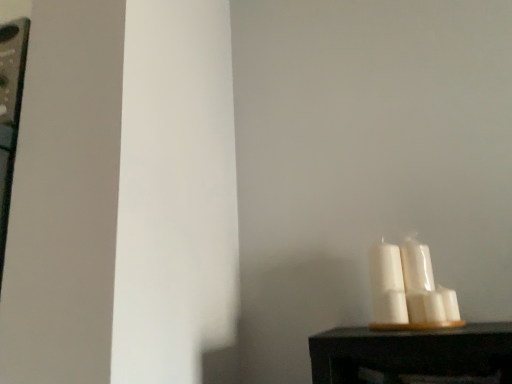
What are the coordinates of `white glossy candle at right, which is counted as the second candle, starting from the right` in the screenshot? It's located at (387, 285).

The width and height of the screenshot is (512, 384). Describe the element at coordinates (387, 285) in the screenshot. I see `white glossy candle at right, which is counted as the second candle, starting from the right` at that location.

Describe the element at coordinates (449, 303) in the screenshot. I see `white matte candle at lower right, which ranks as the first candle in right-to-left order` at that location.

How much space does white matte candle at lower right, which ranks as the first candle in right-to-left order, occupy vertically?

Answer: white matte candle at lower right, which ranks as the first candle in right-to-left order, is 7.56 centimeters in height.

In order to face white matte candle at lower right, which ranks as the first candle in right-to-left order, should I rotate leftwards or rightwards?

You should rotate right by 23.555 degrees.

At what (x,y) coordinates should I click in order to perform the action: click on white matte candle at lower right, which ranks as the first candle in right-to-left order. Please return your answer as a coordinate pair (x, y). The height and width of the screenshot is (384, 512). Looking at the image, I should click on (449, 303).

The image size is (512, 384). What are the coordinates of `white glossy candle at right, which is counted as the second candle, starting from the right` in the screenshot? It's located at (387, 285).

Considering the positions of objects white matte candle at lower right, which ranks as the first candle in right-to-left order, and white glossy candle at right, which is counted as the second candle, starting from the right, in the image provided, who is more to the left, white matte candle at lower right, which ranks as the first candle in right-to-left order, or white glossy candle at right, which is counted as the second candle, starting from the right,?

→ From the viewer's perspective, white glossy candle at right, which is counted as the second candle, starting from the right, appears more on the left side.

Consider the image. Is white matte candle at lower right, the second candle viewed from the left, in front of or behind white glossy candle at right, which is counted as the second candle, starting from the right, in the image?

Clearly, white matte candle at lower right, the second candle viewed from the left, is in front of white glossy candle at right, which is counted as the second candle, starting from the right.

Which is in front, point (455, 296) or point (385, 294)?

Point (385, 294)

From the image's perspective, is white matte candle at lower right, the second candle viewed from the left, located above white glossy candle at right, which is counted as the second candle, starting from the right?

Incorrect, from the image's perspective, white matte candle at lower right, the second candle viewed from the left, is lower than white glossy candle at right, which is counted as the second candle, starting from the right.

From a real-world perspective, is white matte candle at lower right, which ranks as the first candle in right-to-left order, positioned above or below white glossy candle at right, which ranks as the first candle in left-to-right order?

white matte candle at lower right, which ranks as the first candle in right-to-left order, is situated lower than white glossy candle at right, which ranks as the first candle in left-to-right order, in the real world.

Is white matte candle at lower right, which ranks as the first candle in right-to-left order, thinner than white glossy candle at right, which ranks as the first candle in left-to-right order?

Yes, white matte candle at lower right, which ranks as the first candle in right-to-left order, is thinner than white glossy candle at right, which ranks as the first candle in left-to-right order.

Considering the sizes of objects white matte candle at lower right, which ranks as the first candle in right-to-left order, and white glossy candle at right, which is counted as the second candle, starting from the right, in the image provided, who is shorter, white matte candle at lower right, which ranks as the first candle in right-to-left order, or white glossy candle at right, which is counted as the second candle, starting from the right,?

Standing shorter between the two is white matte candle at lower right, which ranks as the first candle in right-to-left order.

Can you confirm if white matte candle at lower right, the second candle viewed from the left, is bigger than white glossy candle at right, which is counted as the second candle, starting from the right?

Incorrect, white matte candle at lower right, the second candle viewed from the left, is not larger than white glossy candle at right, which is counted as the second candle, starting from the right.

Is white matte candle at lower right, which ranks as the first candle in right-to-left order, completely or partially outside of white glossy candle at right, which ranks as the first candle in left-to-right order?

Yes.

Is white matte candle at lower right, the second candle viewed from the left, touching white glossy candle at right, which is counted as the second candle, starting from the right?

No.

Could you tell me if white matte candle at lower right, the second candle viewed from the left, is facing white glossy candle at right, which is counted as the second candle, starting from the right?

No, white matte candle at lower right, the second candle viewed from the left, is not facing towards white glossy candle at right, which is counted as the second candle, starting from the right.

Measure the distance between white matte candle at lower right, the second candle viewed from the left, and white glossy candle at right, which is counted as the second candle, starting from the right.

They are 4.65 inches apart.

Locate an element on the screen. This screenshot has height=384, width=512. candle below the white glossy candle at right, which is counted as the second candle, starting from the right (from the image's perspective) is located at coordinates coord(449,303).

Between white glossy candle at right, which ranks as the first candle in left-to-right order, and white matte candle at lower right, which ranks as the first candle in right-to-left order, which one appears on the left side from the viewer's perspective?

white glossy candle at right, which ranks as the first candle in left-to-right order.

From the picture: Is white glossy candle at right, which is counted as the second candle, starting from the right, positioned behind white matte candle at lower right, the second candle viewed from the left?

Yes, it is.

Which point is more forward, (389, 279) or (445, 288)?

The point (445, 288) is in front.

From the image's perspective, who appears lower, white glossy candle at right, which is counted as the second candle, starting from the right, or white matte candle at lower right, which ranks as the first candle in right-to-left order?

From the image's view, white matte candle at lower right, which ranks as the first candle in right-to-left order, is below.

From a real-world perspective, is white glossy candle at right, which ranks as the first candle in left-to-right order, positioned above or below white matte candle at lower right, the second candle viewed from the left?

From a real-world perspective, white glossy candle at right, which ranks as the first candle in left-to-right order, is physically above white matte candle at lower right, the second candle viewed from the left.

In the scene shown: Is white glossy candle at right, which ranks as the first candle in left-to-right order, thinner than white matte candle at lower right, the second candle viewed from the left?

No.

Is white glossy candle at right, which ranks as the first candle in left-to-right order, taller than white matte candle at lower right, which ranks as the first candle in right-to-left order?

Yes.

Considering the relative sizes of white glossy candle at right, which ranks as the first candle in left-to-right order, and white matte candle at lower right, the second candle viewed from the left, in the image provided, is white glossy candle at right, which ranks as the first candle in left-to-right order, bigger than white matte candle at lower right, the second candle viewed from the left,?

Correct, white glossy candle at right, which ranks as the first candle in left-to-right order, is larger in size than white matte candle at lower right, the second candle viewed from the left.

Can we say white glossy candle at right, which is counted as the second candle, starting from the right, lies outside white matte candle at lower right, which ranks as the first candle in right-to-left order?

Yes.

Are white glossy candle at right, which is counted as the second candle, starting from the right, and white matte candle at lower right, which ranks as the first candle in right-to-left order, far apart?

No, white glossy candle at right, which is counted as the second candle, starting from the right, is not far away from white matte candle at lower right, which ranks as the first candle in right-to-left order.

Is white glossy candle at right, which ranks as the first candle in left-to-right order, facing away from white matte candle at lower right, which ranks as the first candle in right-to-left order?

No.

Find the location of a particular element. Image resolution: width=512 pixels, height=384 pixels. candle to the right of white glossy candle at right, which ranks as the first candle in left-to-right order is located at coordinates (449, 303).

Identify the location of candle above the white matte candle at lower right, the second candle viewed from the left (from the image's perspective). (387, 285).

Find the location of a particular element. The image size is (512, 384). candle that is below the white glossy candle at right, which ranks as the first candle in left-to-right order (from the image's perspective) is located at coordinates (449, 303).